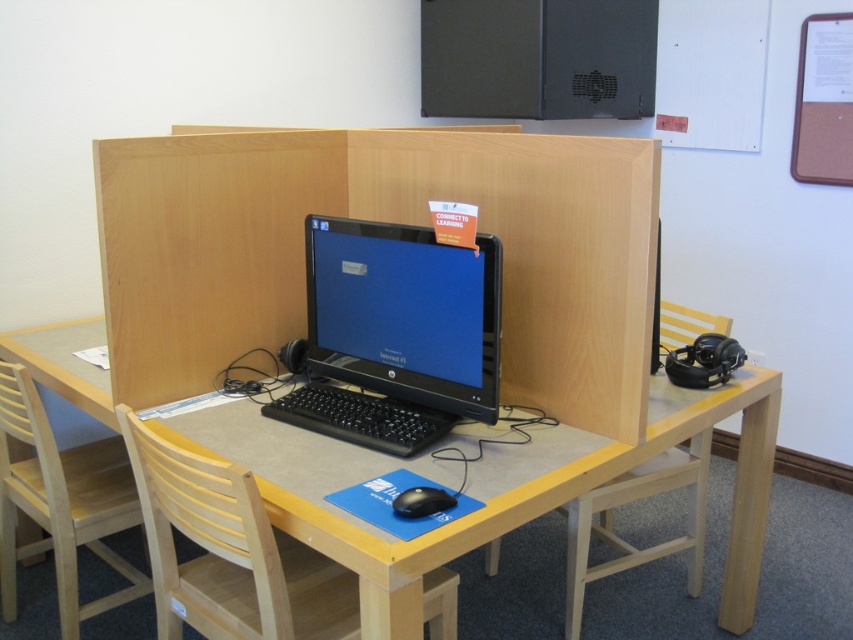
Question: Which point is farther to the camera?

Choices:
 (A) wooden chair at center
 (B) brown corkboard at upper right
 (C) light wood chair at lower left

Answer: (B)

Question: Considering the relative positions of matte black computer desk at center and black plastic mouse at center in the image provided, where is matte black computer desk at center located with respect to black plastic mouse at center?

Choices:
 (A) right
 (B) left

Answer: (A)

Question: Estimate the real-world distances between objects in this image. Which object is farther from the brown corkboard at upper right?

Choices:
 (A) light wood chair at lower left
 (B) black glossy desktop at center

Answer: (A)

Question: Which point is farther to the camera?

Choices:
 (A) black plastic mouse at center
 (B) light wood chair at lower left
 (C) light wood chair at lower right

Answer: (C)

Question: Does wooden chair at center appear over matte black computer desk at center?

Choices:
 (A) no
 (B) yes

Answer: (B)

Question: Does brown corkboard at upper right have a larger size compared to black plastic mouse at center?

Choices:
 (A) no
 (B) yes

Answer: (B)